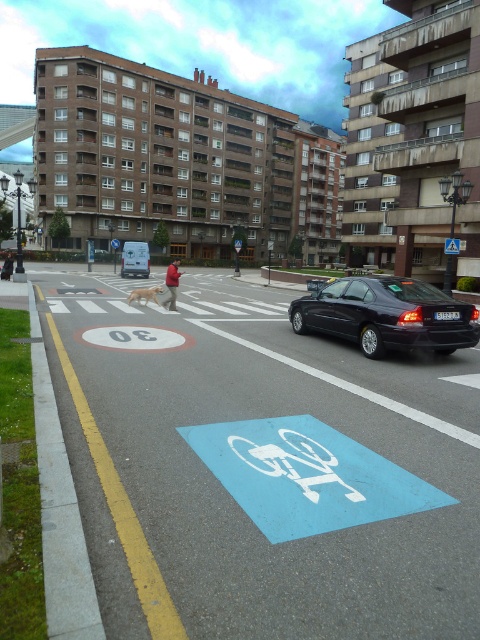
You are a pedestrian crossing the street with your dog. You see the blue painted bicycle sign at lower center and the golden fur dog at center. Which object is closer to you as you cross the street?

The blue painted bicycle sign at lower center is closer to you because it is in front of the golden fur dog at center, indicating it is nearer along your line of sight while crossing the street.

You are standing at the point labeled point [155,294] and want to walk to the point labeled point [238,636]. Which direction should you face to walk directly towards your destination?

You should face forward because point [238,636] is in front of point [155,294].